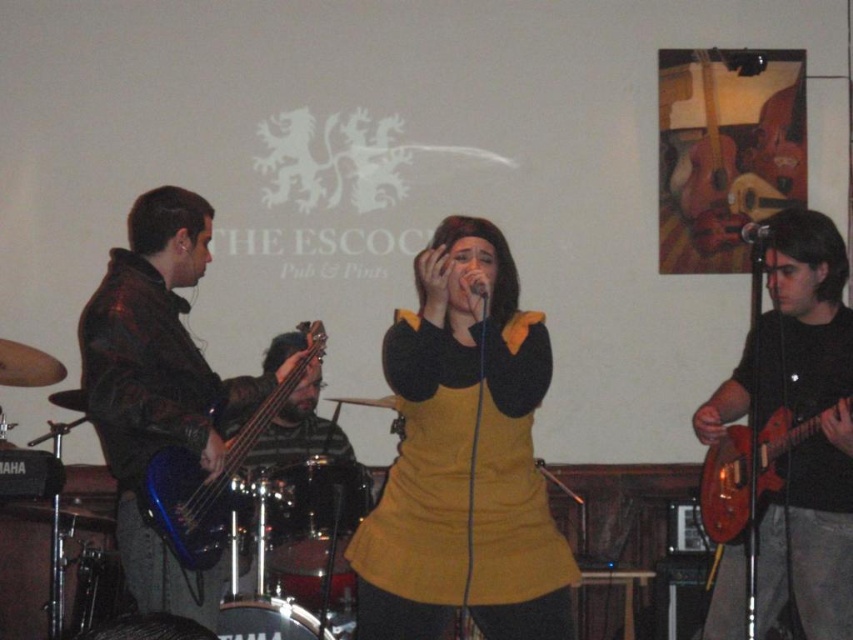
You are a stagehand who needs to place a 1.5 meter long ladder between the shiny red guitar at right and the blue glossy bass guitar at left. Can the ladder fit between them without touching either instrument?

The shiny red guitar at right and blue glossy bass guitar at left are 1.54 meters apart from each other. Since the ladder is 1.5 meters long, it can fit between them with a small gap of 4 centimeters remaining.

You are a photographer in the audience at the live music performance. You want to capture a photo that includes both the blue glossy bass guitar at left and the shiny red electric guitar at right. Based on their positions, which guitar should you focus on first to ensure both are in the frame?

The blue glossy bass guitar at left is positioned over the shiny red electric guitar at right, so focusing on the blue glossy bass guitar at left first will help ensure both guitars are in the frame.

You are a photographer at the back of the stage. You need to capture a photo where both the yellow matte dress at center and the shiny red electric guitar at right are visible. Based on their positions, which object should be placed on the left side in your camera frame?

The yellow matte dress at center is positioned on the left side of the shiny red electric guitar at right, so in your camera frame, the yellow matte dress at center should be on the left side.